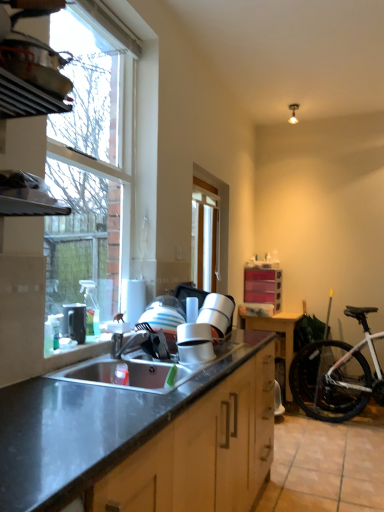
Question: Is brushed metal faucet at sink further to the viewer compared to stainless steel sink at lower center?

Choices:
 (A) yes
 (B) no

Answer: (A)

Question: Does brushed metal faucet at sink lie in front of stainless steel sink at lower center?

Choices:
 (A) no
 (B) yes

Answer: (A)

Question: From the image's perspective, is brushed metal faucet at sink beneath stainless steel sink at lower center?

Choices:
 (A) no
 (B) yes

Answer: (A)

Question: Are brushed metal faucet at sink and stainless steel sink at lower center located far from each other?

Choices:
 (A) yes
 (B) no

Answer: (B)

Question: Does brushed metal faucet at sink contain stainless steel sink at lower center?

Choices:
 (A) no
 (B) yes

Answer: (A)

Question: Is brushed metal faucet at sink oriented towards stainless steel sink at lower center?

Choices:
 (A) yes
 (B) no

Answer: (B)

Question: Does white matte bicycle at lower right have a lesser height compared to brushed metal faucet at sink?

Choices:
 (A) no
 (B) yes

Answer: (A)

Question: From the image's perspective, would you say white matte bicycle at lower right is positioned over brushed metal faucet at sink?

Choices:
 (A) no
 (B) yes

Answer: (A)

Question: Is white matte bicycle at lower right at the left side of brushed metal faucet at sink?

Choices:
 (A) no
 (B) yes

Answer: (A)

Question: From the image's perspective, is white matte bicycle at lower right located beneath brushed metal faucet at sink?

Choices:
 (A) yes
 (B) no

Answer: (A)

Question: Is brushed metal faucet at sink inside white matte bicycle at lower right?

Choices:
 (A) no
 (B) yes

Answer: (A)

Question: Can you confirm if white matte bicycle at lower right is taller than brushed metal faucet at sink?

Choices:
 (A) no
 (B) yes

Answer: (B)

Question: Is white matte bicycle at lower right shorter than wooden table at right?

Choices:
 (A) yes
 (B) no

Answer: (B)